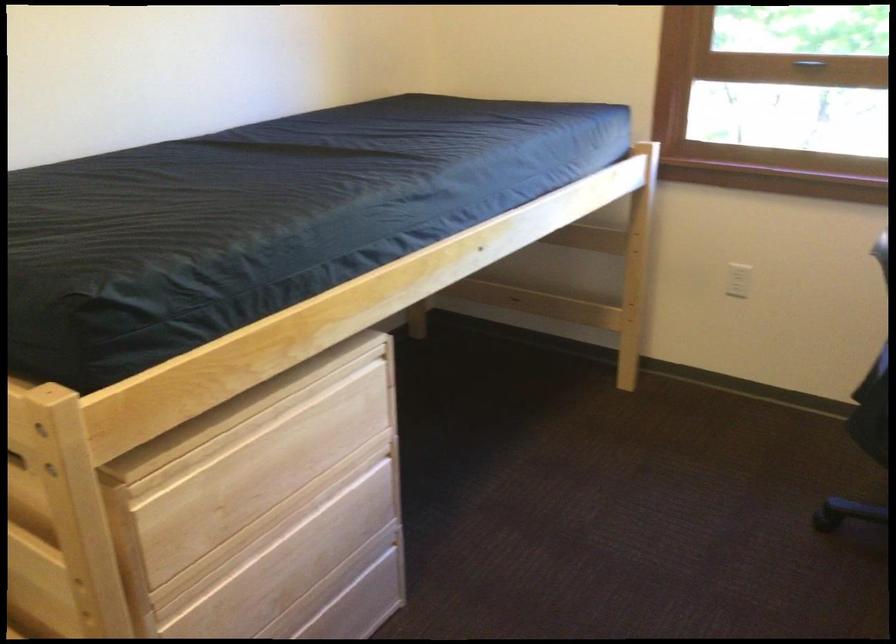
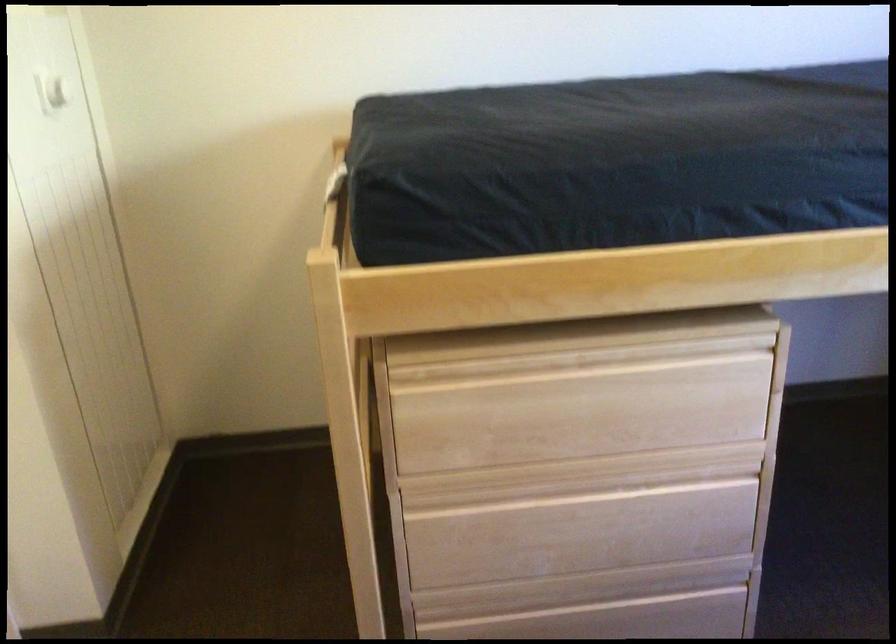
Question: The images are taken continuously from a first-person perspective. In which direction is your viewpoint rotating?

Choices:
 (A) Left
 (B) Right
 (C) Up
 (D) Down

Answer: (A)